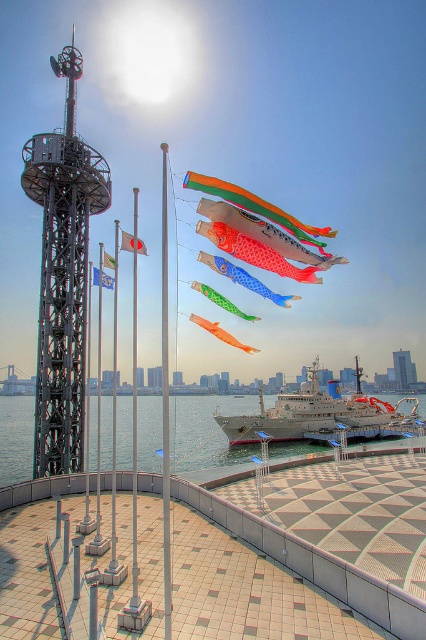
Consider the image. Between silver metallic cruise ship at center and green glossy kite at center, which one has more height?

silver metallic cruise ship at center is taller.

Does point (397, 422) come farther from viewer compared to point (258, 320)?

Yes, it is behind point (258, 320).

Who is more forward, (230, 442) or (210, 298)?

Point (210, 298) is more forward.

Find the location of `silver metallic cruise ship at center`. silver metallic cruise ship at center is located at coordinates (316, 413).

Is orange fabric kite at upper center above blue glossy kite at center?

Indeed, orange fabric kite at upper center is positioned over blue glossy kite at center.

Is orange fabric kite at upper center closer to the viewer compared to blue glossy kite at center?

Yes, it is.

I want to click on orange fabric kite at upper center, so click(259, 230).

Is point (425, 403) positioned in front of point (164, 544)?

That is False.

Who is higher up, transparent water at center or silver metallic pole at center?

silver metallic pole at center

Identify the location of transparent water at center. (206, 432).

The width and height of the screenshot is (426, 640). Identify the location of transparent water at center. (206, 432).